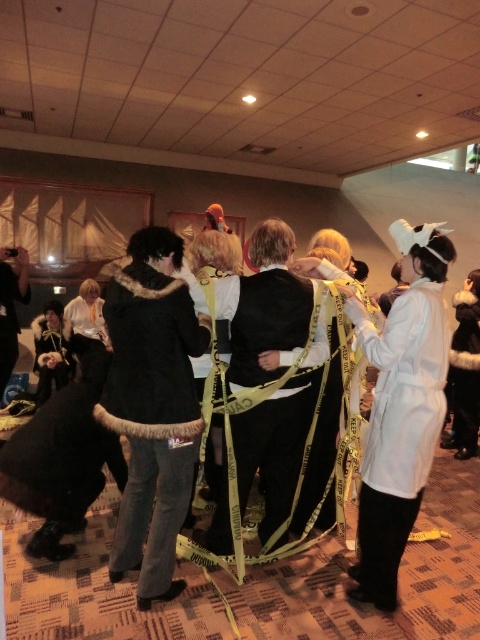
Question: Can you confirm if black satin robe at center is positioned below furry coat at right?

Choices:
 (A) yes
 (B) no

Answer: (A)

Question: Does velvet black coat at center appear under white matte coat at center?

Choices:
 (A) yes
 (B) no

Answer: (B)

Question: Which object appears farthest from the camera in this image?

Choices:
 (A) velvet black coat at center
 (B) furry coat at right

Answer: (B)

Question: Is furry coat at right below velvet black robe at lower left?

Choices:
 (A) no
 (B) yes

Answer: (B)

Question: Estimate the real-world distances between objects in this image. Which object is farther from the black satin robe at center?

Choices:
 (A) velvet black robe at lower left
 (B) fur-trimmed coat at center
 (C) velvet black coat at center

Answer: (A)

Question: Which point is farther to the camera?

Choices:
 (A) (9, 346)
 (B) (187, 330)

Answer: (A)